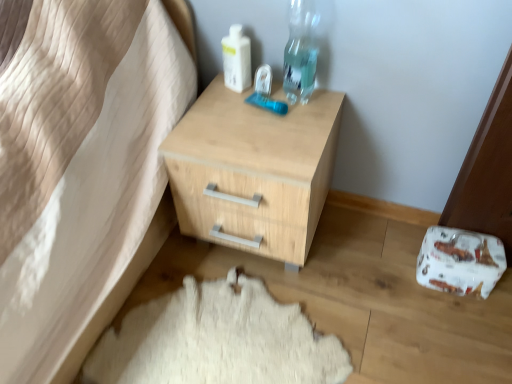
The width and height of the screenshot is (512, 384). What are the coordinates of `free space in front of white plastic bottle at upper center` in the screenshot? It's located at (237, 115).